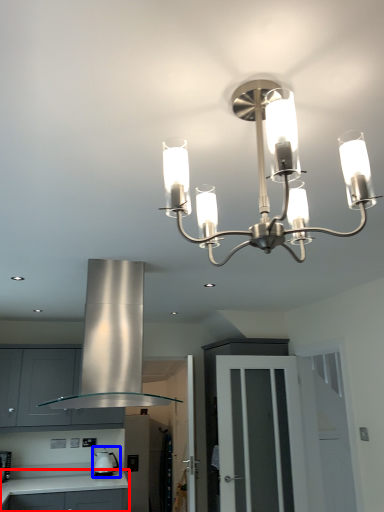
Question: Which object is closer to the camera taking this photo, countertop (highlighted by a red box) or appliance (highlighted by a blue box)?

Choices:
 (A) countertop
 (B) appliance

Answer: (A)